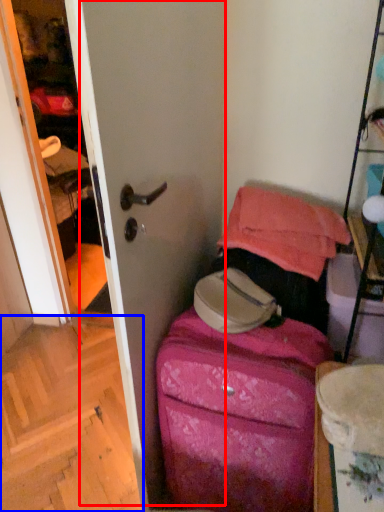
Question: Which object is closer to the camera taking this photo, screen door (highlighted by a red box) or stairwell (highlighted by a blue box)?

Choices:
 (A) screen door
 (B) stairwell

Answer: (A)